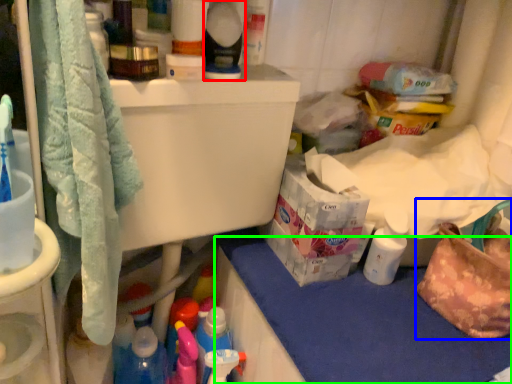
Question: Estimate the real-world distances between objects in this image. Which object is closer to cleaning product (highlighted by a red box), handbag (highlighted by a blue box) or counter top (highlighted by a green box)?

Choices:
 (A) handbag
 (B) counter top

Answer: (B)